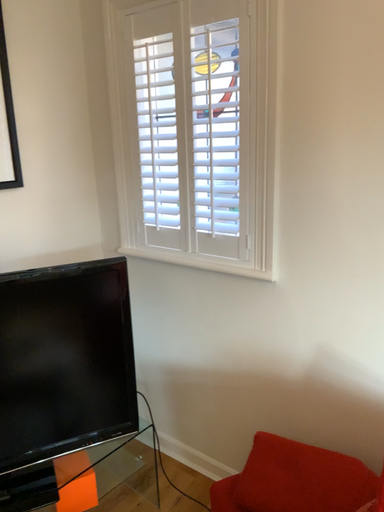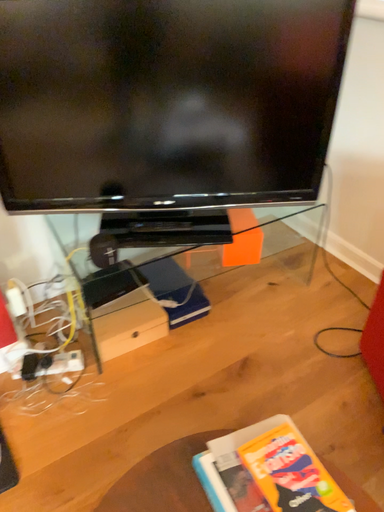
Question: Which way did the camera rotate in the video?

Choices:
 (A) rotated upward
 (B) rotated downward

Answer: (B)